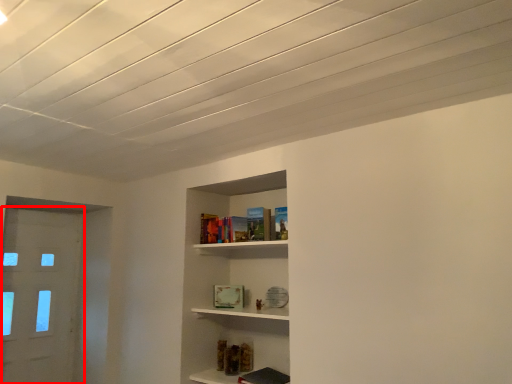
Question: From the image's perspective, what is the correct spatial relationship of door (annotated by the red box) in relation to book?

Choices:
 (A) below
 (B) above

Answer: (A)